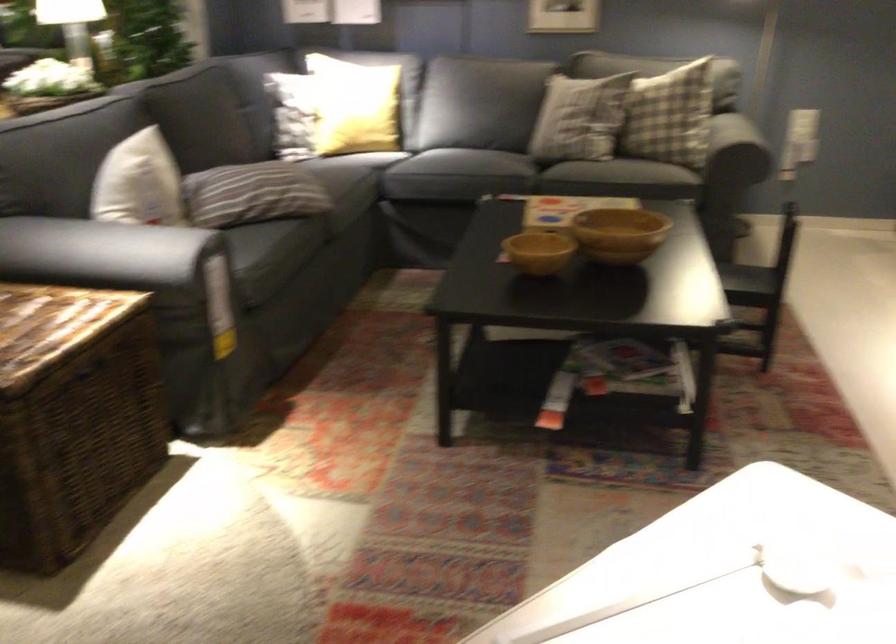
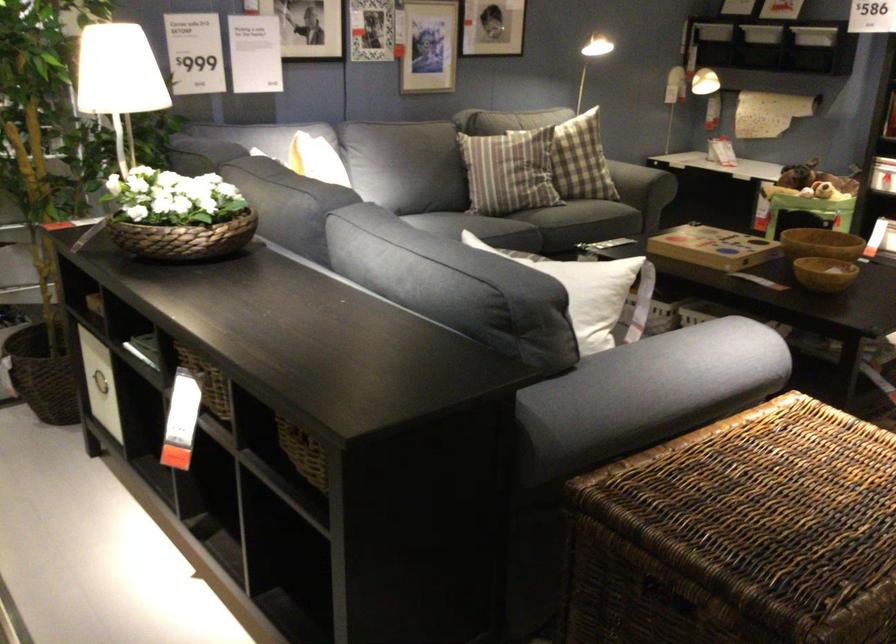
Question: I am providing you with two images of the same scene from different viewpoints. After the viewpoint changes to image2, which objects are now occluded?

Choices:
 (A) woven flower basket
 (B) gray sofa armrest
 (C) green faucet handle
 (D) striped pillow

Answer: (D)